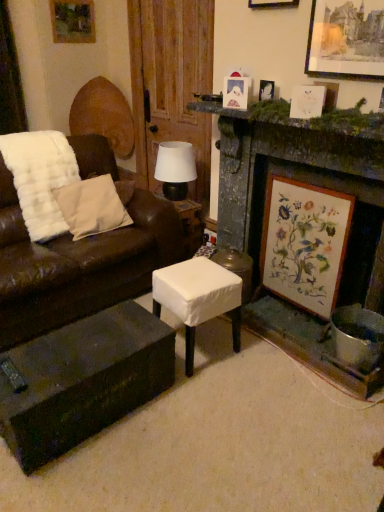
This screenshot has height=512, width=384. What are the coordinates of `free space in front of stone fireplace at center right` in the screenshot? It's located at (253, 419).